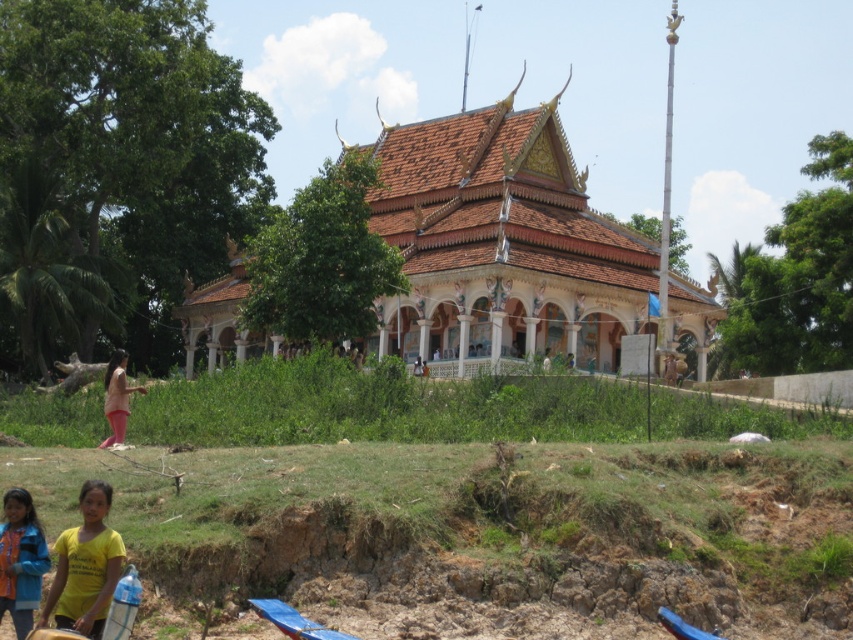
This screenshot has width=853, height=640. What are the coordinates of `yellow matte shirt at lower left` in the screenshot? It's located at (85, 566).

Is point (97, 540) closer to viewer compared to point (675, 360)?

Yes, it is in front of point (675, 360).

Between point (90, 568) and point (676, 378), which one is positioned behind?

The point (676, 378) is behind.

Identify the location of yellow matte shirt at lower left. (85, 566).

Can you confirm if brown tiled roof at center is wider than white fabric person at center?

Indeed, brown tiled roof at center has a greater width compared to white fabric person at center.

Between brown tiled roof at center and white fabric person at center, which one is positioned lower?

white fabric person at center is lower down.

The image size is (853, 640). What do you see at coordinates (515, 250) in the screenshot? I see `brown tiled roof at center` at bounding box center [515, 250].

Where is `brown tiled roof at center`? brown tiled roof at center is located at coordinates (515, 250).

Is yellow fabric shirt at lower left above white fabric person at center?

No, yellow fabric shirt at lower left is not above white fabric person at center.

Does point (21, 550) lie in front of point (544, 368)?

Yes.

Locate an element on the screen. This screenshot has width=853, height=640. yellow fabric shirt at lower left is located at coordinates (20, 560).